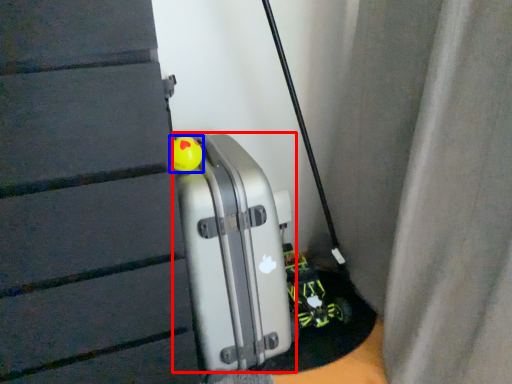
Question: Which point is further to the camera, luggage (highlighted by a red box) or toy (highlighted by a blue box)?

Choices:
 (A) luggage
 (B) toy

Answer: (B)